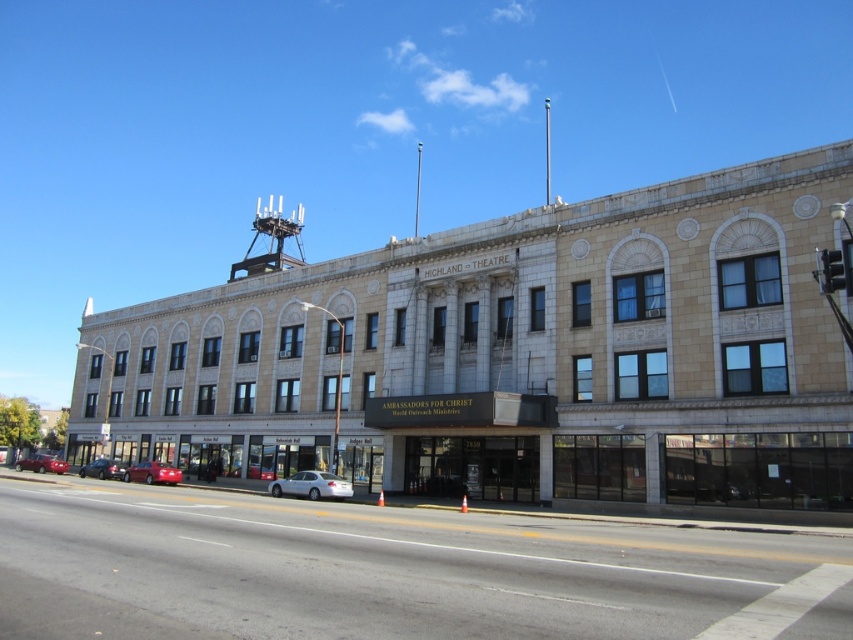
Does point (178, 472) lie in front of point (114, 472)?

That is True.

Who is positioned more to the left, shiny red sedan at lower left or shiny black sedan at lower left?

Positioned to the left is shiny black sedan at lower left.

Who is more forward, (x=144, y=481) or (x=96, y=476)?

Point (x=144, y=481)

The height and width of the screenshot is (640, 853). Identify the location of shiny red sedan at lower left. (152, 474).

Is point (109, 472) more distant than point (250, 477)?

Yes, it is behind point (250, 477).

This screenshot has height=640, width=853. What are the coordinates of `shiny black sedan at lower left` in the screenshot? It's located at (102, 468).

The height and width of the screenshot is (640, 853). Identify the location of shiny black sedan at lower left. (102, 468).

Does metallic red car at lower left have a lesser height compared to red glossy sedan at center?

In fact, metallic red car at lower left may be taller than red glossy sedan at center.

Does metallic red car at lower left appear over red glossy sedan at center?

Actually, metallic red car at lower left is below red glossy sedan at center.

Between point (54, 472) and point (248, 477), which one is positioned behind?

The point (54, 472) is behind.

This screenshot has height=640, width=853. Identify the location of metallic red car at lower left. (42, 464).